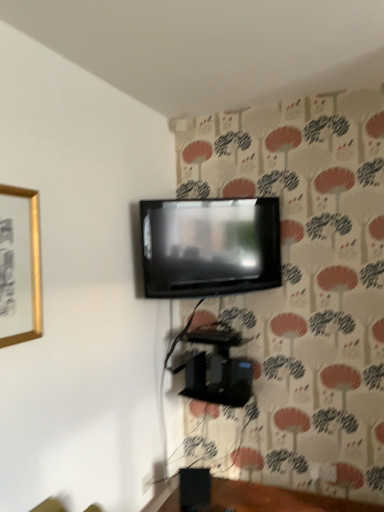
Question: From the image's perspective, is black matte speaker at lower center above or below gold metallic picture frame at upper left?

Choices:
 (A) below
 (B) above

Answer: (A)

Question: In the image, is black matte speaker at lower center on the left side or the right side of gold metallic picture frame at upper left?

Choices:
 (A) left
 (B) right

Answer: (B)

Question: Which object is positioned closest to the black matte speaker at lower center?

Choices:
 (A) gold metallic picture frame at upper left
 (B) matte black tv at upper center
 (C) black glossy speaker at lower center

Answer: (C)

Question: Considering the real-world distances, which object is closest to the gold metallic picture frame at upper left?

Choices:
 (A) black matte speaker at lower center
 (B) matte black tv at upper center
 (C) black glossy speaker at lower center

Answer: (B)